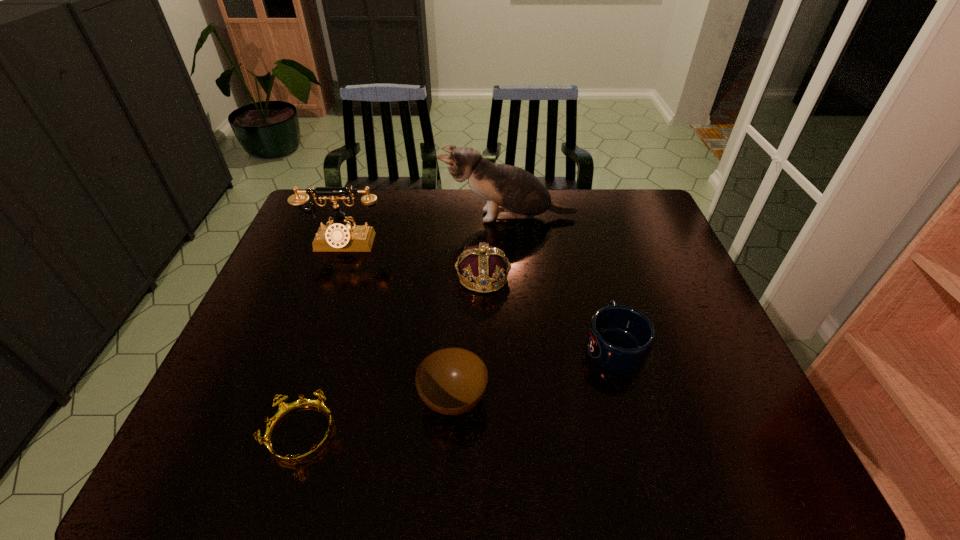
This screenshot has height=540, width=960. Identify the location of vacant space located 0.370m at the face of the farthest object. (332, 217).

The height and width of the screenshot is (540, 960). Identify the location of free spot located 0.330m at the face of the farthest object. (344, 217).

You are a GUI agent. You are given a task and a screenshot of the screen. Output one action in this format:
    pyautogui.click(x=<x>, y=<y>)
    Task: Click on the vacant space situated 0.200m at the face of the farthest object
    Image resolution: width=960 pixels, height=540 pixels.
    Given the screenshot: What is the action you would take?
    pyautogui.click(x=382, y=217)

Image resolution: width=960 pixels, height=540 pixels. Identify the location of vacant space located 0.290m on the dial of the fifth nearest object. (312, 329).

The height and width of the screenshot is (540, 960). I want to click on free space located on the left of the fourth shortest object, so click(396, 277).

The height and width of the screenshot is (540, 960). Identify the location of vacant point located with the handle on the side of the mug. (587, 246).

The height and width of the screenshot is (540, 960). I want to click on vacant space situated 0.230m with the handle on the side of the mug, so click(590, 261).

Find the location of `free spot located 0.050m with the handle on the side of the mug`. free spot located 0.050m with the handle on the side of the mug is located at coordinates (603, 305).

At what (x,y) coordinates should I click in order to perform the action: click on free point located 0.350m on the back of the bowl. Please return your answer as a coordinate pair (x, y). The height and width of the screenshot is (540, 960). Looking at the image, I should click on (460, 271).

Identify the location of free region located on the right of the left crown. coord(404,434).